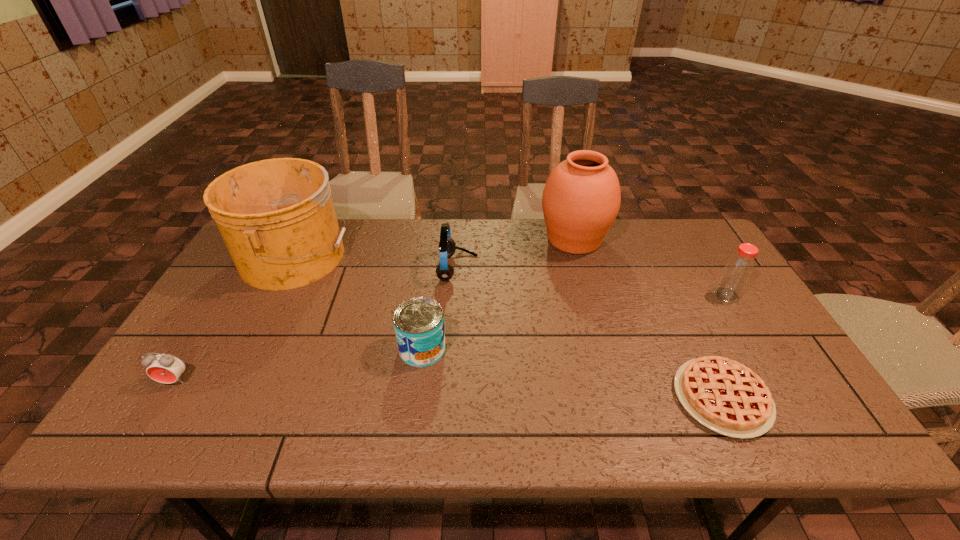
This screenshot has height=540, width=960. I want to click on the fifth object from left to right, so click(x=581, y=199).

Image resolution: width=960 pixels, height=540 pixels. I want to click on bucket, so click(x=276, y=216).

The height and width of the screenshot is (540, 960). I want to click on the rightmost object, so click(x=738, y=270).

Find the location of a particular element. The image size is (960, 540). headset is located at coordinates (444, 271).

This screenshot has width=960, height=540. What are the coordinates of `can` in the screenshot? It's located at (418, 322).

You are a GUI agent. You are given a task and a screenshot of the screen. Output one action in this format:
    pyautogui.click(x=<x>, y=<y>)
    Task: Click on the alarm clock
    The image size is (960, 540).
    Given the screenshot: What is the action you would take?
    pyautogui.click(x=165, y=368)

I want to click on the sixth object from left to right, so click(727, 397).

Where is `pie`? pie is located at coordinates (727, 397).

Where is `vacant region located on the front of the urn`? vacant region located on the front of the urn is located at coordinates (598, 326).

The width and height of the screenshot is (960, 540). Identify the location of vacant area situated 0.290m on the front of the bucket. (230, 381).